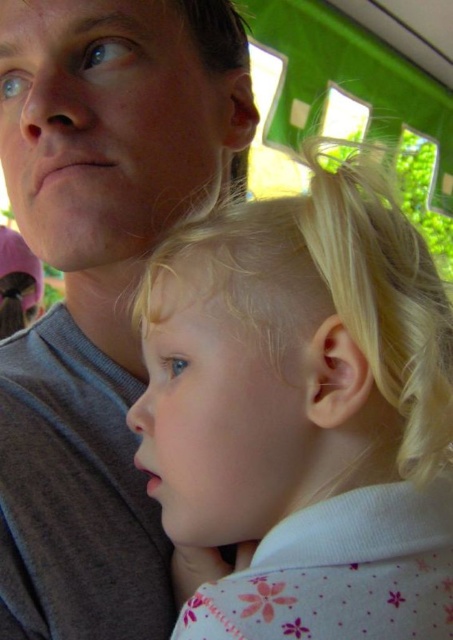
Question: Can you confirm if blonde hair at center is positioned to the right of gray cotton shirt at upper left?

Choices:
 (A) yes
 (B) no

Answer: (A)

Question: Among these points, which one is farthest from the camera?

Choices:
 (A) (144, 634)
 (B) (444, 561)

Answer: (A)

Question: Which of the following is the farthest from the observer?

Choices:
 (A) gray cotton shirt at upper left
 (B) blonde hair at center

Answer: (A)

Question: Among these objects, which one is farthest from the camera?

Choices:
 (A) blonde hair at center
 (B) gray cotton shirt at upper left

Answer: (B)

Question: Is blonde hair at center wider than gray cotton shirt at upper left?

Choices:
 (A) yes
 (B) no

Answer: (B)

Question: Is blonde hair at center wider than gray cotton shirt at upper left?

Choices:
 (A) no
 (B) yes

Answer: (A)